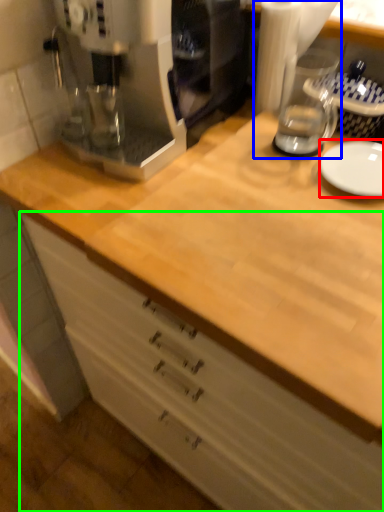
Question: Which is nearer to the plate (highlighted by a red box)? blender (highlighted by a blue box) or cabinetry (highlighted by a green box).

Choices:
 (A) blender
 (B) cabinetry

Answer: (A)